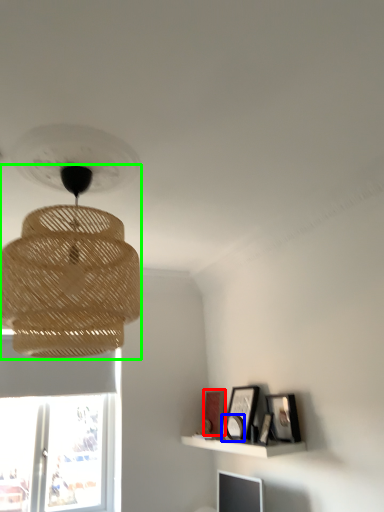
Question: Which object is positioned closest to picture frame (highlighted by a red box)? Select from picture frame (highlighted by a blue box) and lamp (highlighted by a green box).

Choices:
 (A) picture frame
 (B) lamp

Answer: (A)